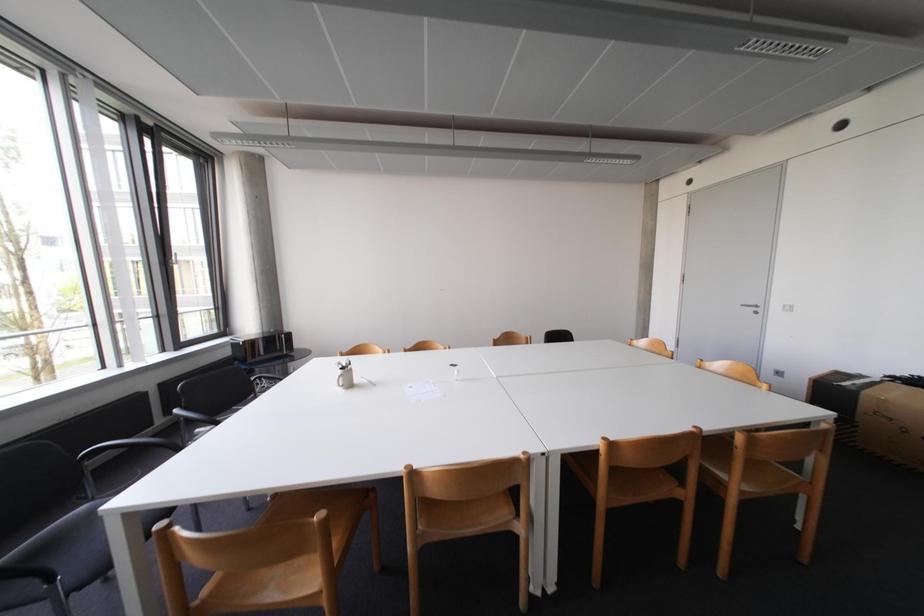
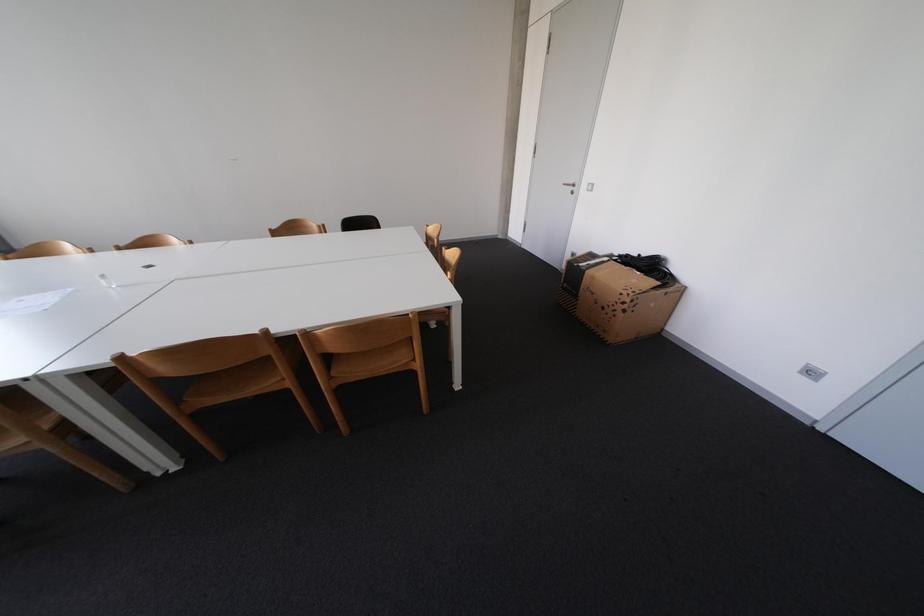
Question: What movement of the cameraman would produce the second image?

Choices:
 (A) Left
 (B) Right
 (C) Forward
 (D) Backward

Answer: (B)